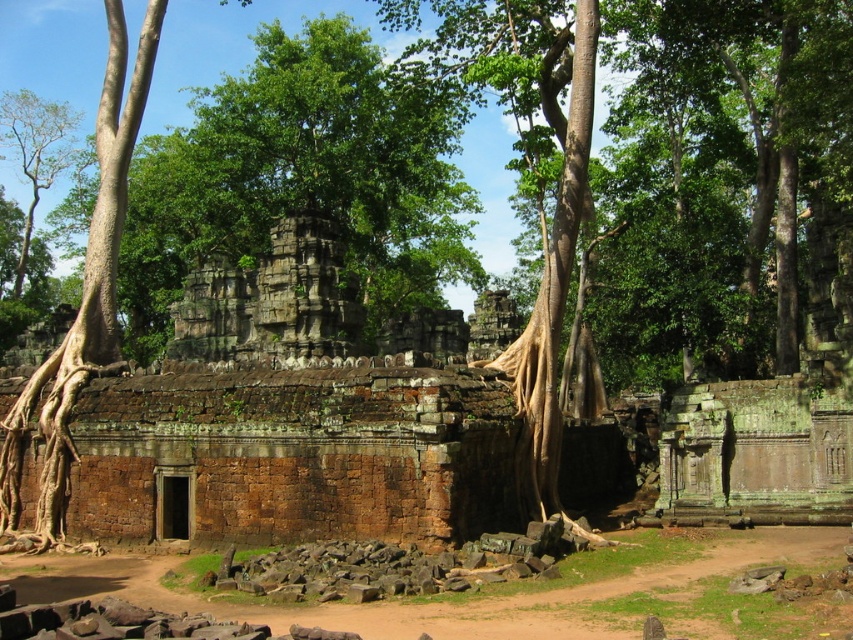
Question: Does brown rough tree roots at left come behind green leafy tree at upper left?

Choices:
 (A) no
 (B) yes

Answer: (A)

Question: Among these objects, which one is nearest to the camera?

Choices:
 (A) brown rough tree roots at left
 (B) green leafy tree at upper left

Answer: (A)

Question: Is brown rough tree roots at left bigger than green leafy tree at upper left?

Choices:
 (A) no
 (B) yes

Answer: (A)

Question: Which object appears farthest from the camera in this image?

Choices:
 (A) brown rough tree roots at left
 (B) green leafy tree at upper left

Answer: (B)

Question: Is brown rough tree roots at left to the left of green leafy tree at upper left from the viewer's perspective?

Choices:
 (A) yes
 (B) no

Answer: (B)